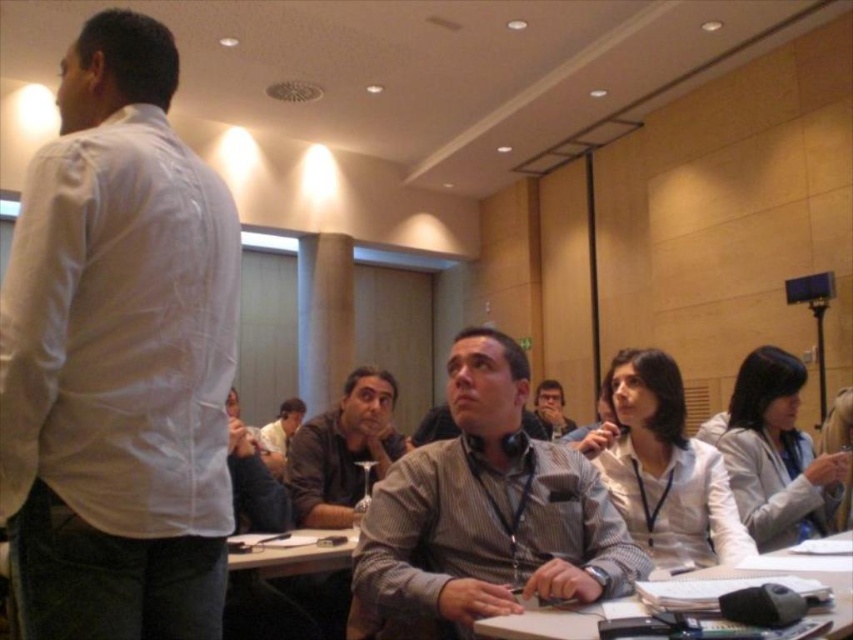
Is striped cotton shirt at center smaller than gray striped shirt at center?

Actually, striped cotton shirt at center might be larger than gray striped shirt at center.

Between point (595, 556) and point (546, 406), which one is positioned in front?

Point (595, 556) is more forward.

Between point (457, 515) and point (547, 412), which one is positioned behind?

Positioned behind is point (547, 412).

Image resolution: width=853 pixels, height=640 pixels. I want to click on striped cotton shirt at center, so click(x=486, y=512).

Between point (341, 548) and point (851, 536), which one is positioned in front?

Point (341, 548) is in front.

Find the location of `white plastic table at center`. white plastic table at center is located at coordinates (288, 592).

This screenshot has width=853, height=640. What are the coordinates of `white plastic table at center` in the screenshot? It's located at (288, 592).

Between striped cotton shirt at center and white plastic table at center, which one is positioned higher?

striped cotton shirt at center is higher up.

Can you confirm if striped cotton shirt at center is thinner than white plastic table at center?

In fact, striped cotton shirt at center might be wider than white plastic table at center.

Between point (439, 541) and point (241, 605), which one is positioned behind?

Point (241, 605)

This screenshot has width=853, height=640. Identify the location of striped cotton shirt at center. (486, 512).